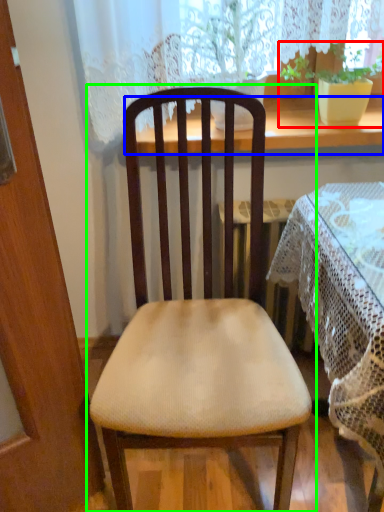
Question: Estimate the real-world distances between objects in this image. Which object is farther from houseplant (highlighted by a red box), window sill (highlighted by a blue box) or chair (highlighted by a green box)?

Choices:
 (A) window sill
 (B) chair

Answer: (B)